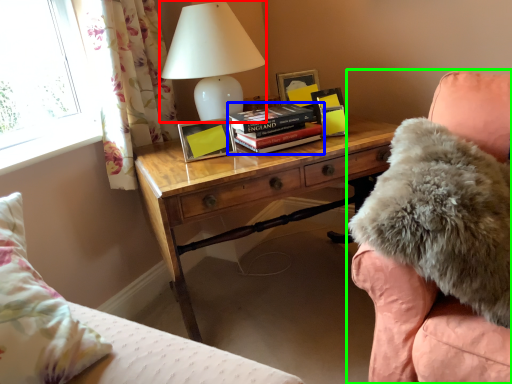
Question: Which is nearer to the table lamp (highlighted by a red box)? book (highlighted by a blue box) or chair (highlighted by a green box).

Choices:
 (A) book
 (B) chair

Answer: (A)